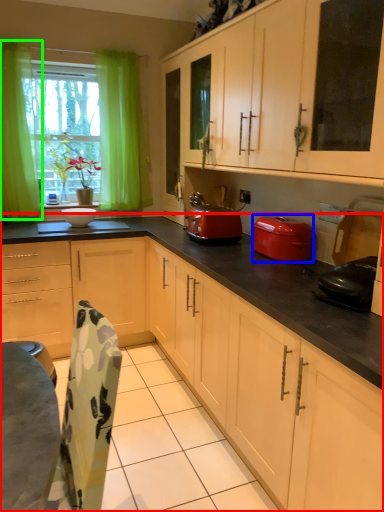
Question: Which is nearer to the cabinetry (highlighted by a red box)? kitchen appliance (highlighted by a blue box) or curtain (highlighted by a green box).

Choices:
 (A) kitchen appliance
 (B) curtain

Answer: (A)